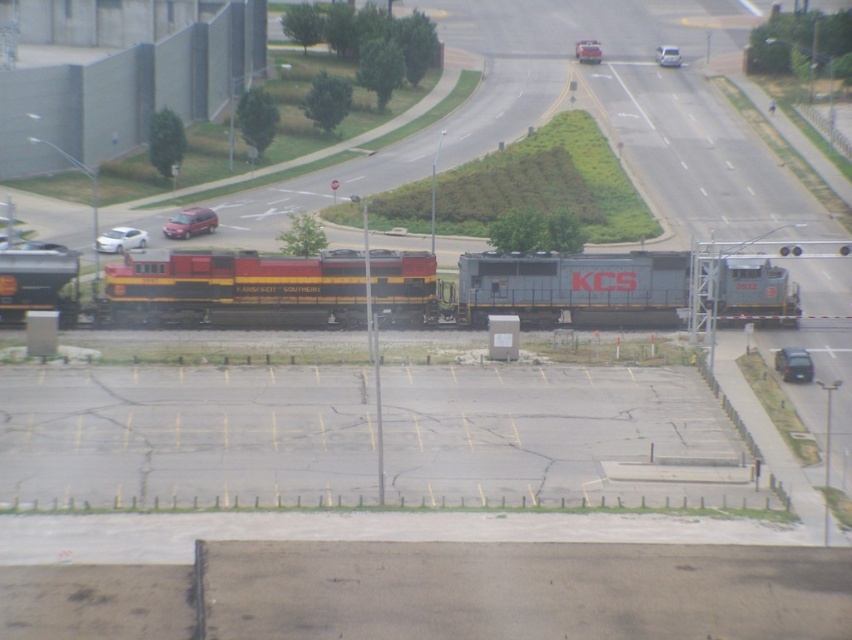
You are standing at the edge of the parking lot and see the point marked at coordinates (793,364). What object is located at that point?

The point at coordinates (793,364) corresponds to a metallic gray sedan at center.

In the scene shown: You are standing at the train crossing and want to know which of the two points, point (786, 353) or point (591, 60), is closer to you. Can you determine this based on the scene?

Point (786, 353) is closer to the camera than point (591, 60), so it is closer to you.